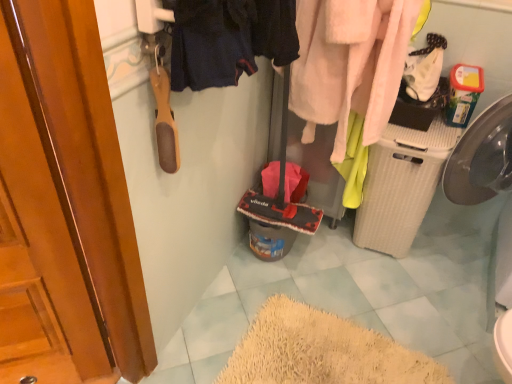
Question: Which direction should I rotate to look at dark blue fabric at upper center, which is counted as the 1th clothing, starting from the left, — up or down?

Choices:
 (A) up
 (B) down

Answer: (A)

Question: Does dark blue fabric at upper center, which is counted as the 1th clothing, starting from the left, appear on the right side of fuzzy pink towel at upper right, which is the 1th clothing from back to front?

Choices:
 (A) yes
 (B) no

Answer: (B)

Question: From a real-world perspective, is dark blue fabric at upper center, which is counted as the 1th clothing, starting from the left, located higher than fuzzy pink towel at upper right, acting as the first clothing starting from the right?

Choices:
 (A) yes
 (B) no

Answer: (A)

Question: Is dark blue fabric at upper center, acting as the 2th clothing starting from the back, not close to fuzzy pink towel at upper right, acting as the first clothing starting from the right?

Choices:
 (A) no
 (B) yes

Answer: (A)

Question: From the image's perspective, is dark blue fabric at upper center, the 1th clothing from the front, below fuzzy pink towel at upper right, which is the 1th clothing from back to front?

Choices:
 (A) yes
 (B) no

Answer: (A)

Question: Can you confirm if dark blue fabric at upper center, placed as the 2th clothing when sorted from right to left, is taller than fuzzy pink towel at upper right, acting as the first clothing starting from the right?

Choices:
 (A) no
 (B) yes

Answer: (A)

Question: Considering the relative sizes of dark blue fabric at upper center, placed as the 2th clothing when sorted from right to left, and fuzzy pink towel at upper right, positioned as the second clothing in front-to-back order, in the image provided, is dark blue fabric at upper center, placed as the 2th clothing when sorted from right to left, bigger than fuzzy pink towel at upper right, positioned as the second clothing in front-to-back order,?

Choices:
 (A) no
 (B) yes

Answer: (A)

Question: Considering the relative sizes of fuzzy pink towel at upper right, positioned as the second clothing in front-to-back order, and dark blue fabric at upper center, placed as the 2th clothing when sorted from right to left, in the image provided, is fuzzy pink towel at upper right, positioned as the second clothing in front-to-back order, bigger than dark blue fabric at upper center, placed as the 2th clothing when sorted from right to left,?

Choices:
 (A) yes
 (B) no

Answer: (A)

Question: Considering the relative positions of fuzzy pink towel at upper right, which is the 1th clothing from back to front, and dark blue fabric at upper center, the 1th clothing from the front, in the image provided, is fuzzy pink towel at upper right, which is the 1th clothing from back to front, to the right of dark blue fabric at upper center, the 1th clothing from the front, from the viewer's perspective?

Choices:
 (A) yes
 (B) no

Answer: (A)

Question: From a real-world perspective, is fuzzy pink towel at upper right, positioned as the second clothing in front-to-back order, located higher than dark blue fabric at upper center, the 1th clothing from the front?

Choices:
 (A) no
 (B) yes

Answer: (A)

Question: From the image's perspective, would you say fuzzy pink towel at upper right, which is the 1th clothing from back to front, is shown under dark blue fabric at upper center, which is counted as the 1th clothing, starting from the left?

Choices:
 (A) no
 (B) yes

Answer: (A)

Question: Is fuzzy pink towel at upper right, positioned as the second clothing in front-to-back order, positioned with its back to dark blue fabric at upper center, the 1th clothing from the front?

Choices:
 (A) no
 (B) yes

Answer: (A)

Question: Would you consider fuzzy pink towel at upper right, which is the 1th clothing from back to front, to be distant from dark blue fabric at upper center, the 1th clothing from the front?

Choices:
 (A) yes
 (B) no

Answer: (B)

Question: In terms of size, does dark blue fabric at upper center, acting as the 2th clothing starting from the back, appear bigger or smaller than fuzzy pink towel at upper right, positioned as the second clothing in front-to-back order?

Choices:
 (A) small
 (B) big

Answer: (A)